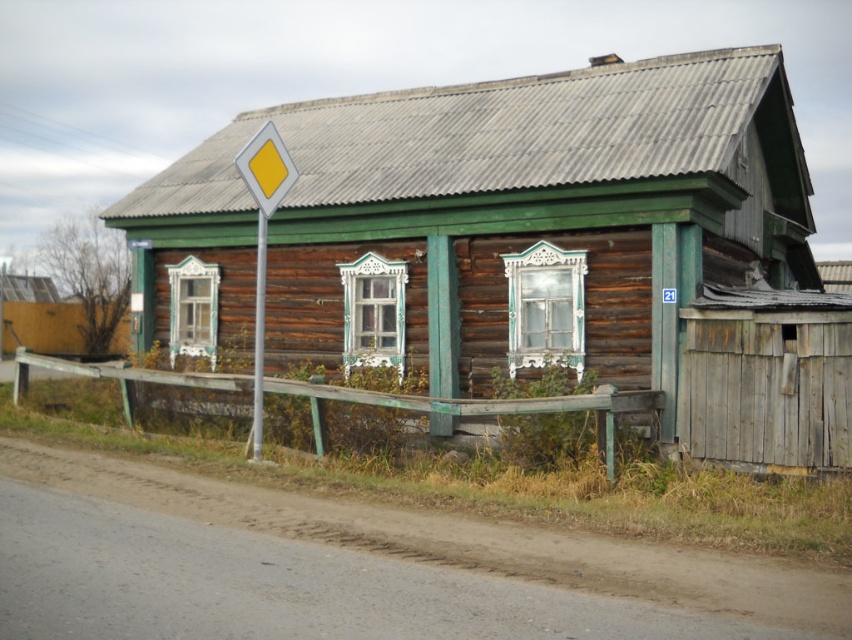
Question: Can you confirm if yellow plastic diamond at left is wider than metallic pole at left?

Choices:
 (A) yes
 (B) no

Answer: (B)

Question: Which point appears farthest from the camera in this image?

Choices:
 (A) (257, 182)
 (B) (258, 356)

Answer: (B)

Question: Does wooden hut at center have a larger size compared to green wooden fence at lower center?

Choices:
 (A) yes
 (B) no

Answer: (A)

Question: Does wooden hut at center have a lesser width compared to yellow plastic diamond at upper left?

Choices:
 (A) yes
 (B) no

Answer: (B)

Question: Which object appears farthest from the camera in this image?

Choices:
 (A) metallic pole at left
 (B) wooden hut at center

Answer: (A)

Question: Among these objects, which one is nearest to the camera?

Choices:
 (A) wooden hut at center
 (B) yellow plastic diamond at left
 (C) yellow plastic diamond at upper left

Answer: (C)